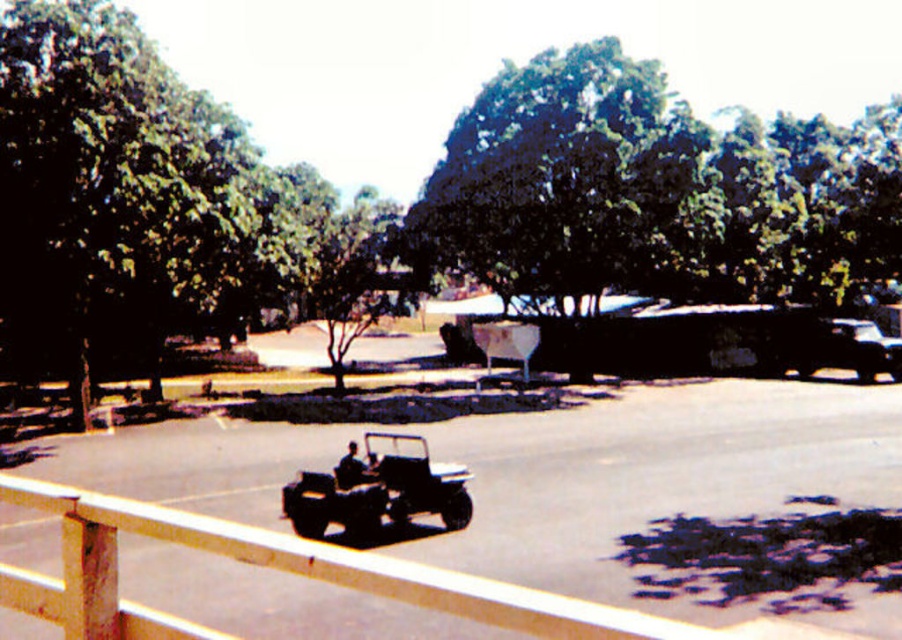
Who is taller, wooden fence at lower center or metallic silver jeep at lower center?

wooden fence at lower center is taller.

Is wooden fence at lower center positioned before metallic silver jeep at lower center?

That is True.

Describe the element at coordinates (299, 573) in the screenshot. The width and height of the screenshot is (902, 640). I see `wooden fence at lower center` at that location.

Locate an element on the screen. wooden fence at lower center is located at coordinates (299, 573).

Can you confirm if green leafy tree at center is positioned to the right of metallic silver jeep at lower center?

Incorrect, green leafy tree at center is not on the right side of metallic silver jeep at lower center.

Is green leafy tree at center closer to camera compared to metallic silver jeep at lower center?

No, it is behind metallic silver jeep at lower center.

Where is `green leafy tree at center`? The width and height of the screenshot is (902, 640). green leafy tree at center is located at coordinates (411, 204).

Identify the location of green leafy tree at center. (411, 204).

Can you confirm if green leafy tree at upper left is positioned below metallic silver jeep at lower center?

Actually, green leafy tree at upper left is above metallic silver jeep at lower center.

Who is lower down, green leafy tree at upper left or metallic silver jeep at lower center?

metallic silver jeep at lower center is lower down.

Where is `green leafy tree at upper left`? This screenshot has width=902, height=640. green leafy tree at upper left is located at coordinates (118, 186).